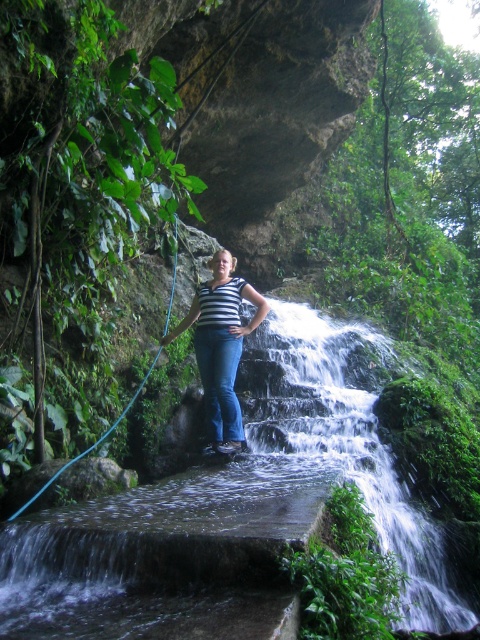
Question: Among these points, which one is farthest from the camera?

Choices:
 (A) (303, 444)
 (B) (205, 369)
 (C) (111, 426)

Answer: (B)

Question: Which point is closer to the camera?

Choices:
 (A) (110, 429)
 (B) (201, 320)
 (C) (379, 440)

Answer: (A)

Question: Observing the image, what is the correct spatial positioning of white frothy water at center in reference to blue rubber hose at center?

Choices:
 (A) above
 (B) below

Answer: (B)

Question: Can you confirm if striped shirt at center is bigger than blue rubber hose at center?

Choices:
 (A) no
 (B) yes

Answer: (A)

Question: Does white frothy water at center have a larger size compared to striped shirt at center?

Choices:
 (A) yes
 (B) no

Answer: (A)

Question: Which of the following is the closest to the observer?

Choices:
 (A) blue rubber hose at center
 (B) striped shirt at center

Answer: (A)